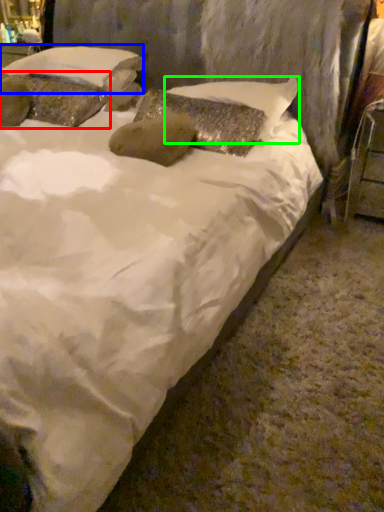
Question: Estimate the real-world distances between objects in this image. Which object is farther from pillow (highlighted by a red box), pillow (highlighted by a blue box) or pillow (highlighted by a green box)?

Choices:
 (A) pillow
 (B) pillow

Answer: (B)